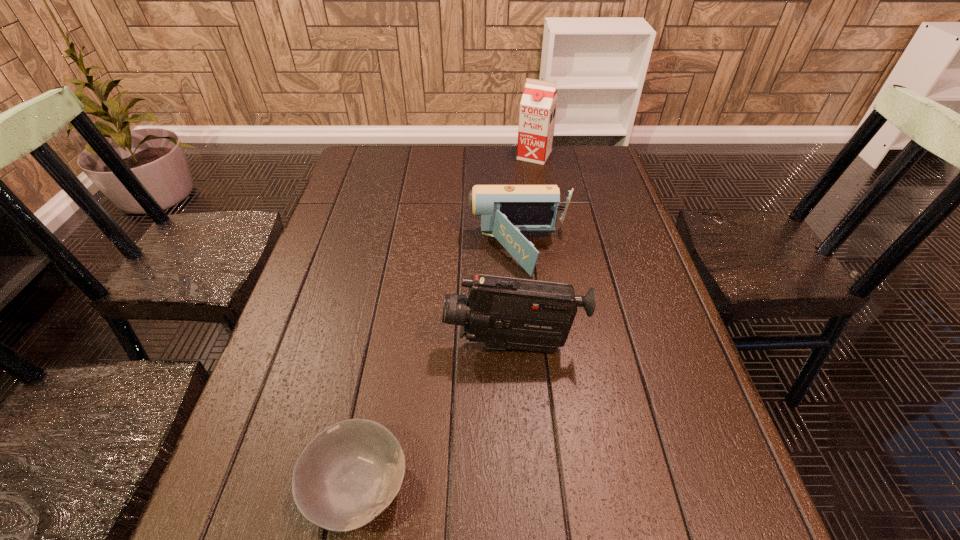
Identify which object is located as the second nearest to the third farthest object. Please provide its 2D coordinates. Your answer should be formatted as a tuple, i.e. [(x, y)], where the tuple contains the x and y coordinates of a point satisfying the conditions above.

[(348, 474)]